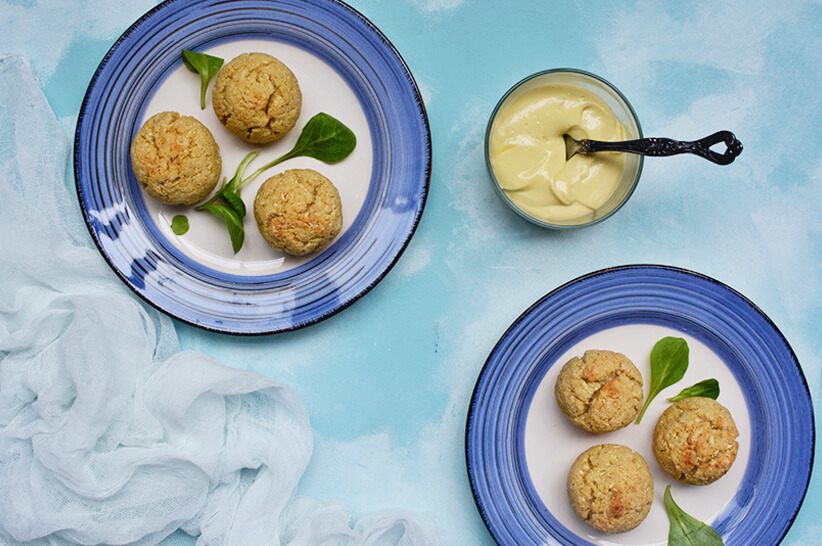
Image resolution: width=822 pixels, height=546 pixels. I want to click on plate, so click(x=395, y=185), click(x=739, y=446).